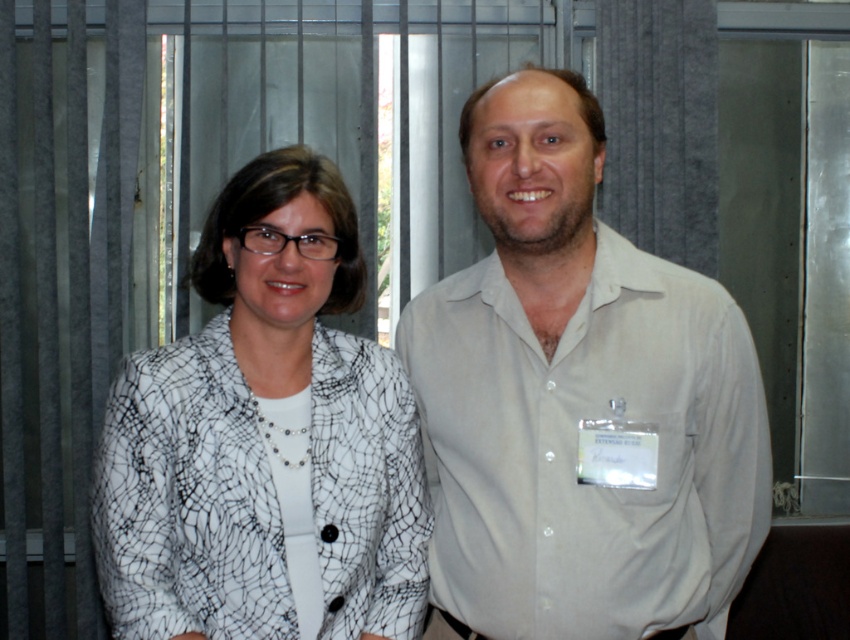
You are standing in the room and want to take a photo of the point at coordinates point (428, 333). Your camera has a focal length of 50mm and you are currently 2.0 meters away from the point. Should you move closer or farther away to ensure the point fills the frame properly?

The point (428, 333) is 1.60 meters away from the camera. Since you are currently 2.0 meters away, you should move closer to the point to reduce the distance to 1.60 meters, ensuring it fills the frame properly.

You are standing in the room and want to move from the point at coordinates point (x=514, y=433) to the point at coordinates point (x=418, y=486). Which direction should you move in order to reach the second point?

To move from point (x=514, y=433) to point (x=418, y=486), you should move towards the upper right direction since the second point is located at a higher x and lower y coordinate compared to the first point.

You are a photographer setting up a shoot in this room. You need to ensure that the light beige shirt at center and the white textured blazer at center are both visible in the frame. Considering their sizes, which one might require more space in the composition?

The light beige shirt at center is bigger than the white textured blazer at center, so it might require more space in the composition to ensure it is fully visible.